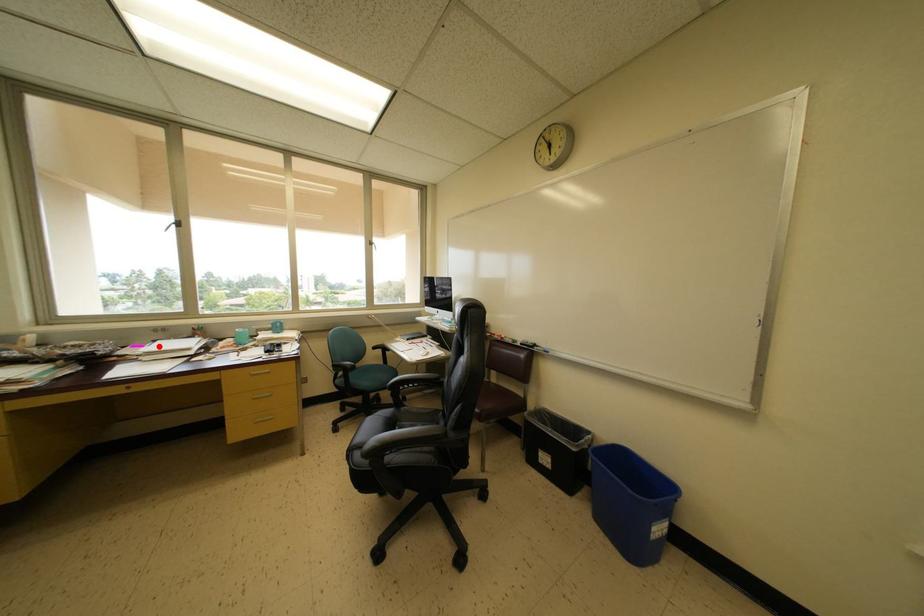
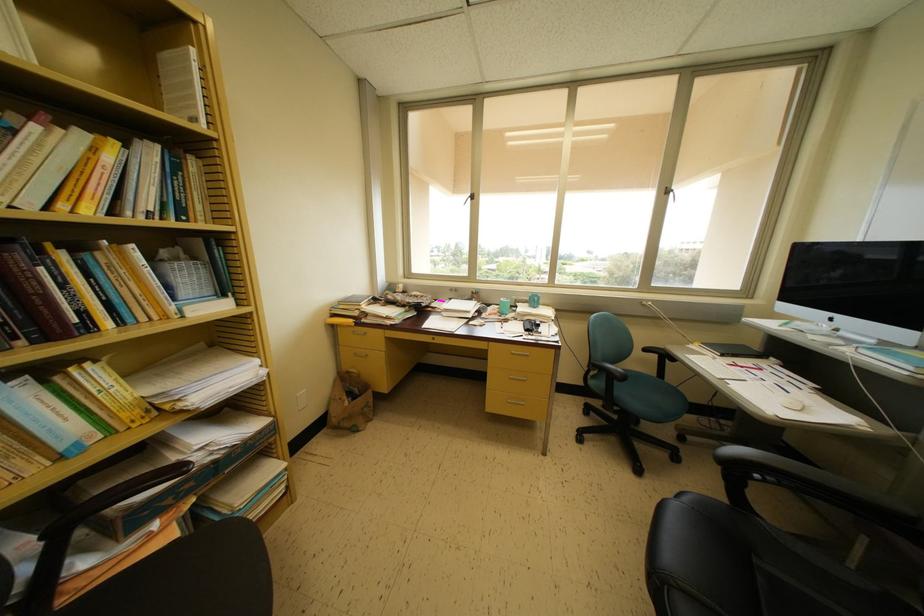
The point at the highlighted location is marked in the first image. Where is the corresponding point in the second image?

(455, 304)